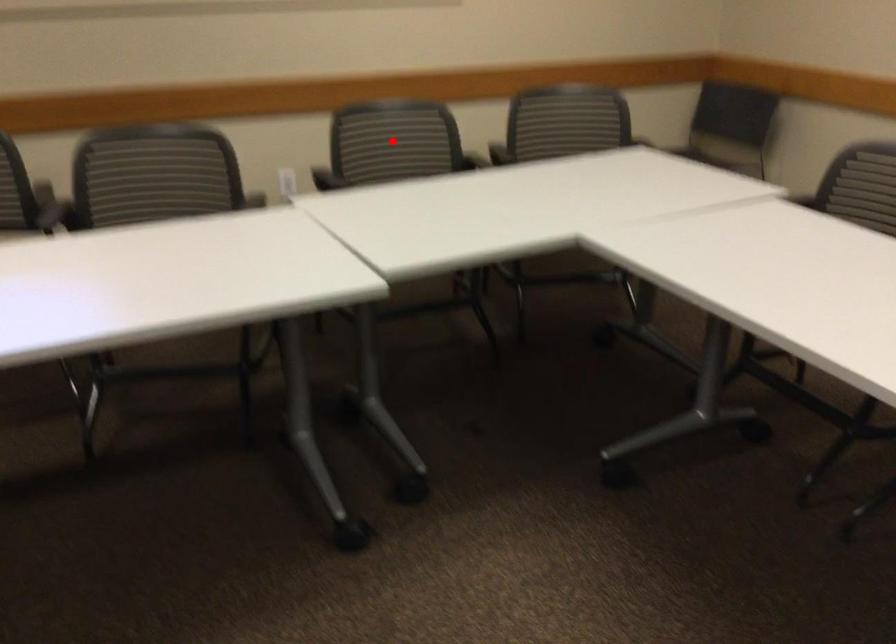
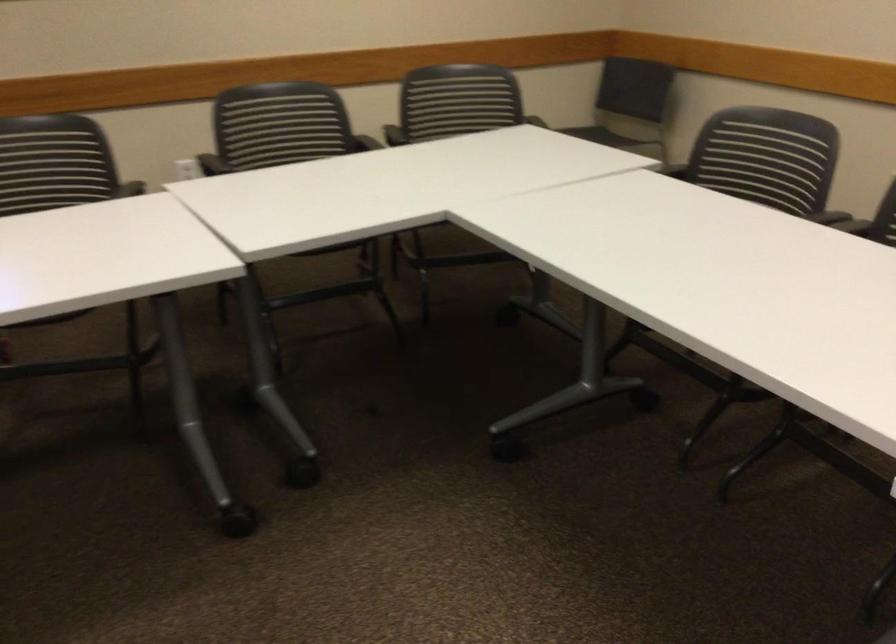
Question: I am providing you with two images of the same scene from different viewpoints. A red point is marked on the first image. Is the red point's position out of view in image 2?

Choices:
 (A) Yes
 (B) No

Answer: (A)